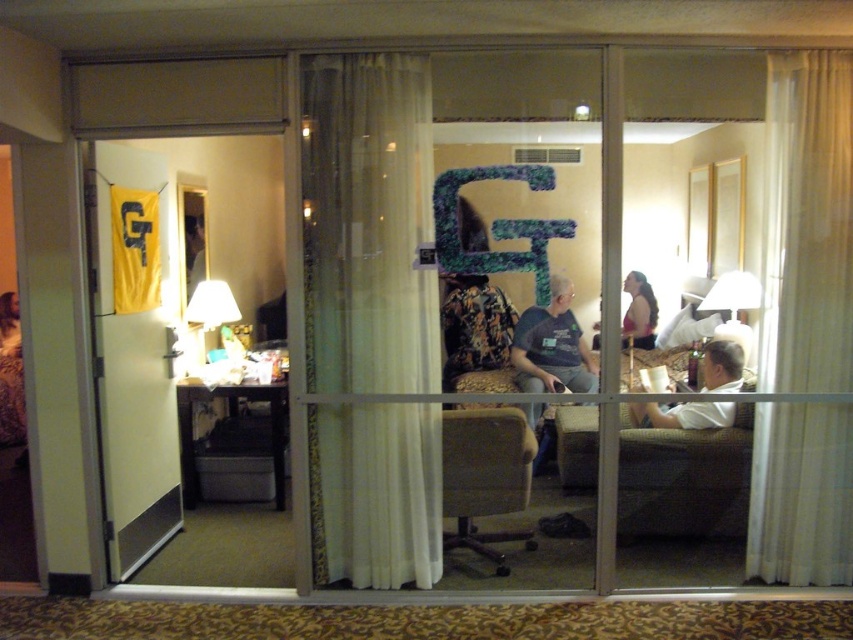
Is point (96, 289) closer to camera compared to point (578, 417)?

Yes, point (96, 289) is in front of point (578, 417).

Is the position of white matte screen door at left more distant than that of dark brown leather armchair at center?

No, white matte screen door at left is closer to the viewer.

Where is `white matte screen door at left`? The image size is (853, 640). white matte screen door at left is located at coordinates (132, 353).

At what (x,y) coordinates should I click in order to perform the action: click on white matte screen door at left. Please return your answer as a coordinate pair (x, y). Looking at the image, I should click on (132, 353).

I want to click on clear glass door at left, so click(189, 365).

Does clear glass door at left appear on the left side of white matte screen door at left?

No, clear glass door at left is not to the left of white matte screen door at left.

Which is in front, point (267, 253) or point (141, 394)?

Point (141, 394) is more forward.

Find the location of a particular element. clear glass door at left is located at coordinates (189, 365).

Based on the photo, between sheer white curtain at center and white sheer curtain at right, which one has less height?

With less height is white sheer curtain at right.

Consider the image. Does sheer white curtain at center appear over white sheer curtain at right?

No.

Is point (331, 275) closer to camera compared to point (773, 330)?

That is True.

This screenshot has width=853, height=640. What are the coordinates of `sheer white curtain at center` in the screenshot? It's located at pos(367,224).